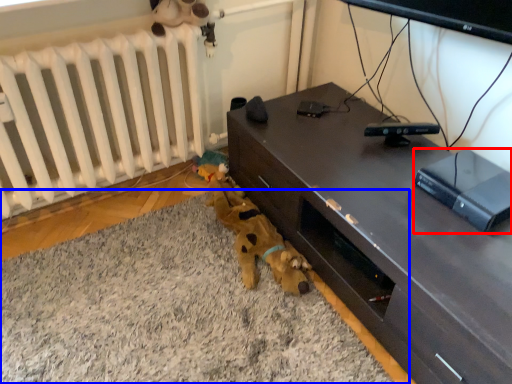
Question: Which object appears closest to the camera in this image, equipment (highlighted by a red box) or plain (highlighted by a blue box)?

Choices:
 (A) equipment
 (B) plain

Answer: (B)